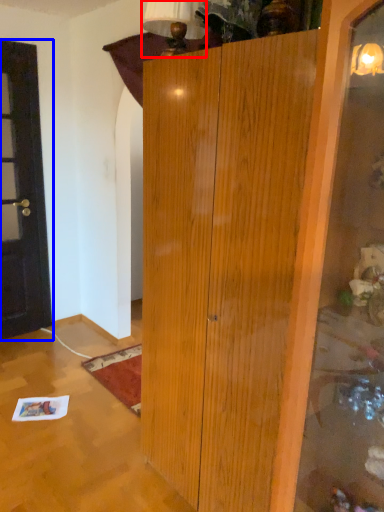
Question: Which object appears closest to the camera in this image, lamp (highlighted by a red box) or door (highlighted by a blue box)?

Choices:
 (A) lamp
 (B) door

Answer: (A)